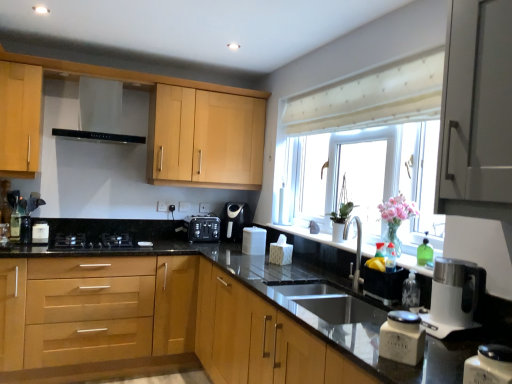
Question: Considering their positions, is satin black toaster at center, the first appliance when ordered from left to right, located in front of or behind light wood/finish cabinet at upper left, the 3th cabinetry positioned from the bottom?

Choices:
 (A) behind
 (B) front

Answer: (A)

Question: Based on their sizes in the image, would you say satin black toaster at center, which is the first appliance from back to front, is bigger or smaller than light wood/finish cabinet at upper left, the 3th cabinetry positioned from the bottom?

Choices:
 (A) big
 (B) small

Answer: (B)

Question: Estimate the real-world distances between objects in this image. Which object is closer to the satin black toaster at center, the first appliance when ordered from left to right?

Choices:
 (A) pink glass vase at window
 (B) black matte exhaust hood at upper center
 (C) black matte gas stove at lower left
 (D) clear plastic bottle at sink right, which is the 2th bottle from back to front
 (E) satin grey cabinet at upper right, placed as the 2th cabinetry when sorted from bottom to top

Answer: (C)

Question: Which is farther from the light wood/finish cabinet at upper left, positioned as the first cabinetry in top-to-bottom order?

Choices:
 (A) light wood cabinet at center, the 1th cabinetry when ordered from bottom to top
 (B) black matte exhaust hood at upper center
 (C) white glossy container at lower right, which is counted as the first kitchen appliance, starting from the right
 (D) white plastic kettle at right
 (E) satin grey cabinet at upper right, the second cabinetry from the top

Answer: (C)